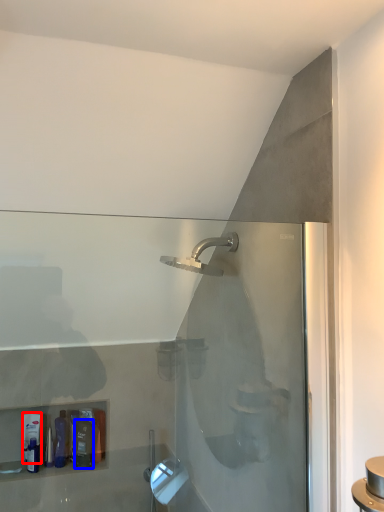
Question: Which object is closer to the camera taking this photo, toiletry (highlighted by a red box) or toiletry (highlighted by a blue box)?

Choices:
 (A) toiletry
 (B) toiletry

Answer: (B)